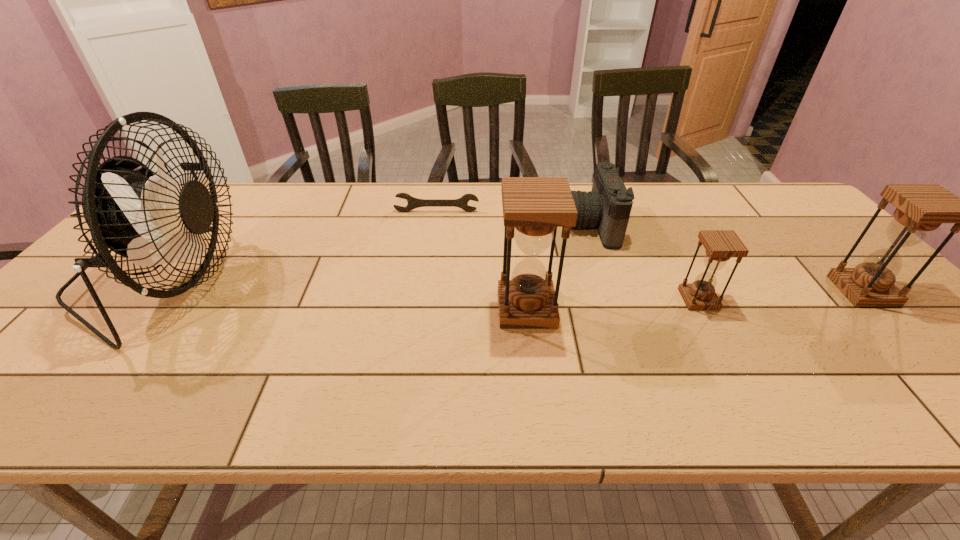
Please point a free position for a hourglass on the left. Please provide its 2D coordinates. Your answer should be formatted as a tuple, i.e. [(x, y)], where the tuple contains the x and y coordinates of a point satisfying the conditions above.

[(348, 318)]